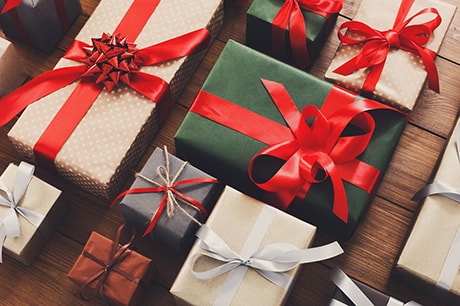
The height and width of the screenshot is (306, 460). Find the location of `red ribbons on presents`. red ribbons on presents is located at coordinates (107, 62), (318, 155), (369, 51), (308, 22), (184, 184), (10, 7).